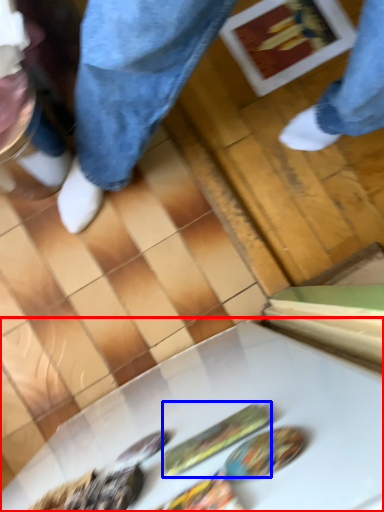
Question: Among these objects, which one is nearest to the camera, table (highlighted by a red box) or food (highlighted by a blue box)?

Choices:
 (A) table
 (B) food

Answer: (A)